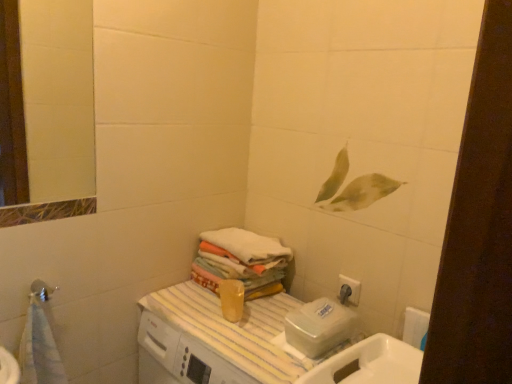
Question: Is matte silver shower head at lower left at the right side of white soft towel at center?

Choices:
 (A) yes
 (B) no

Answer: (B)

Question: Could white soft towel at center be considered to be inside matte silver shower head at lower left?

Choices:
 (A) yes
 (B) no

Answer: (B)

Question: Is matte silver shower head at lower left turned away from white soft towel at center?

Choices:
 (A) no
 (B) yes

Answer: (A)

Question: Can you confirm if matte silver shower head at lower left is taller than white soft towel at center?

Choices:
 (A) yes
 (B) no

Answer: (A)

Question: Can you confirm if matte silver shower head at lower left is wider than white soft towel at center?

Choices:
 (A) no
 (B) yes

Answer: (A)

Question: Is matte silver shower head at lower left positioned before white soft towel at center?

Choices:
 (A) yes
 (B) no

Answer: (A)

Question: Are white glossy sink at lower right and white matte toilet paper at lower right making contact?

Choices:
 (A) no
 (B) yes

Answer: (A)

Question: Considering the relative sizes of white glossy sink at lower right and white matte toilet paper at lower right in the image provided, is white glossy sink at lower right smaller than white matte toilet paper at lower right?

Choices:
 (A) no
 (B) yes

Answer: (A)

Question: Does white glossy sink at lower right have a greater width compared to white matte toilet paper at lower right?

Choices:
 (A) yes
 (B) no

Answer: (A)

Question: Is white matte toilet paper at lower right completely or partially inside white glossy sink at lower right?

Choices:
 (A) yes
 (B) no

Answer: (B)

Question: From a real-world perspective, is white glossy sink at lower right physically above white matte toilet paper at lower right?

Choices:
 (A) yes
 (B) no

Answer: (B)

Question: From a real-world perspective, is white glossy sink at lower right beneath white matte toilet paper at lower right?

Choices:
 (A) no
 (B) yes

Answer: (B)

Question: Is white matte toilet paper at lower right to the right of matte silver shower head at lower left from the viewer's perspective?

Choices:
 (A) no
 (B) yes

Answer: (B)